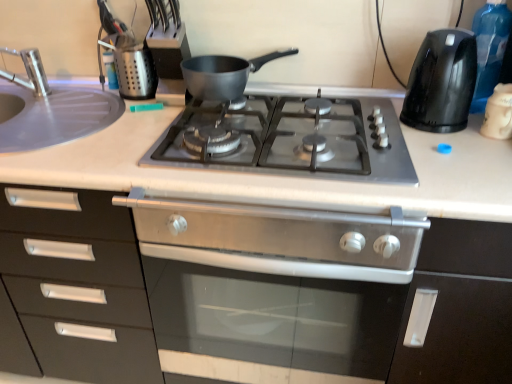
The height and width of the screenshot is (384, 512). Find the location of `transparent plastic bottle at right`. transparent plastic bottle at right is located at coordinates (489, 49).

Locate an element on the screen. The width and height of the screenshot is (512, 384). white glossy coffee cup at upper right, the third kitchen appliance viewed from the left is located at coordinates (498, 113).

What do you see at coordinates (498, 113) in the screenshot? I see `white glossy coffee cup at upper right, which is counted as the 1th kitchen appliance, starting from the right` at bounding box center [498, 113].

Describe the element at coordinates (132, 67) in the screenshot. I see `metallic silver utensil holder at upper left` at that location.

Locate an element on the screen. Image resolution: width=512 pixels, height=384 pixels. silver metallic faucet at left is located at coordinates (29, 71).

Locate an element on the screen. transparent plastic bottle at right is located at coordinates (489, 49).

In terms of size, does transparent plastic bottle at right appear bigger or smaller than silver metallic faucet at left?

transparent plastic bottle at right is bigger than silver metallic faucet at left.

Which object is positioned more to the right, transparent plastic bottle at right or silver metallic faucet at left?

Positioned to the right is transparent plastic bottle at right.

Would you say silver metallic faucet at left is part of transparent plastic bottle at right's contents?

No, silver metallic faucet at left is not a part of transparent plastic bottle at right.

In the scene shown: Is transparent plastic bottle at right positioned with its back to silver metallic faucet at left?

That's not correct — transparent plastic bottle at right is not looking away from silver metallic faucet at left.

Which of these two, metallic silver utensil holder at upper left or matte black pot at center, the 3th kitchen appliance viewed from the right, is wider?

With larger width is matte black pot at center, the 3th kitchen appliance viewed from the right.

Looking at this image, which object is closer to the camera, metallic silver utensil holder at upper left or matte black pot at center, acting as the 1th kitchen appliance starting from the left?

matte black pot at center, acting as the 1th kitchen appliance starting from the left, is in front.

Where is `the 1st kitchen appliance below when counting from the metallic silver utensil holder at upper left (from the image's perspective)`? the 1st kitchen appliance below when counting from the metallic silver utensil holder at upper left (from the image's perspective) is located at coordinates (223, 74).

Which object is positioned more to the right, metallic silver utensil holder at upper left or matte black pot at center, the 3th kitchen appliance viewed from the right?

matte black pot at center, the 3th kitchen appliance viewed from the right, is more to the right.

Considering the positions of objects white glossy coffee cup at upper right, which is counted as the 1th kitchen appliance, starting from the right, and stainless steel gas stove at center in the image provided, who is in front, white glossy coffee cup at upper right, which is counted as the 1th kitchen appliance, starting from the right, or stainless steel gas stove at center?

stainless steel gas stove at center is more forward.

Between white glossy coffee cup at upper right, which is counted as the 1th kitchen appliance, starting from the right, and stainless steel gas stove at center, which one appears on the left side from the viewer's perspective?

stainless steel gas stove at center.

Can you tell me how much white glossy coffee cup at upper right, the third kitchen appliance viewed from the left, and stainless steel gas stove at center differ in facing direction?

There is a 0.000242-degree angle between the facing directions of white glossy coffee cup at upper right, the third kitchen appliance viewed from the left, and stainless steel gas stove at center.

Between black plastic kettle at right, which ranks as the second kitchen appliance in left-to-right order, and stainless steel gas stove at center, which one appears on the left side from the viewer's perspective?

stainless steel gas stove at center is more to the left.

Looking at this image, is black plastic kettle at right, which ranks as the second kitchen appliance in left-to-right order, further to camera compared to stainless steel gas stove at center?

Yes.

Locate an element on the screen. kitchen appliance that is the 1st object located behind the stainless steel gas stove at center is located at coordinates (441, 82).

Is stainless steel gas stove at center located within black plastic kettle at right, the second kitchen appliance when ordered from right to left?

No.

Is matte black pot at center, the 3th kitchen appliance viewed from the right, in front of or behind white glossy coffee cup at upper right, which is counted as the 1th kitchen appliance, starting from the right, in the image?

Visually, matte black pot at center, the 3th kitchen appliance viewed from the right, is located behind white glossy coffee cup at upper right, which is counted as the 1th kitchen appliance, starting from the right.

Does point (249, 61) come closer to viewer compared to point (486, 133)?

That is False.

Would you consider matte black pot at center, acting as the 1th kitchen appliance starting from the left, to be distant from white glossy coffee cup at upper right, which is counted as the 1th kitchen appliance, starting from the right?

No, matte black pot at center, acting as the 1th kitchen appliance starting from the left, is not far away from white glossy coffee cup at upper right, which is counted as the 1th kitchen appliance, starting from the right.

Can you confirm if matte black pot at center, acting as the 1th kitchen appliance starting from the left, is shorter than white glossy coffee cup at upper right, the third kitchen appliance viewed from the left?

Correct, matte black pot at center, acting as the 1th kitchen appliance starting from the left, is not as tall as white glossy coffee cup at upper right, the third kitchen appliance viewed from the left.

How far apart are white glossy coffee cup at upper right, the third kitchen appliance viewed from the left, and black plastic kettle at right, which ranks as the second kitchen appliance in left-to-right order?

white glossy coffee cup at upper right, the third kitchen appliance viewed from the left, is 4.75 inches from black plastic kettle at right, which ranks as the second kitchen appliance in left-to-right order.

Is white glossy coffee cup at upper right, which is counted as the 1th kitchen appliance, starting from the right, looking in the opposite direction of black plastic kettle at right, which ranks as the second kitchen appliance in left-to-right order?

No, white glossy coffee cup at upper right, which is counted as the 1th kitchen appliance, starting from the right,'s orientation is not away from black plastic kettle at right, which ranks as the second kitchen appliance in left-to-right order.

Is white glossy coffee cup at upper right, the third kitchen appliance viewed from the left, thinner than black plastic kettle at right, which ranks as the second kitchen appliance in left-to-right order?

Indeed, white glossy coffee cup at upper right, the third kitchen appliance viewed from the left, has a lesser width compared to black plastic kettle at right, which ranks as the second kitchen appliance in left-to-right order.

Who is smaller, white glossy coffee cup at upper right, the third kitchen appliance viewed from the left, or black plastic kettle at right, the second kitchen appliance when ordered from right to left?

white glossy coffee cup at upper right, the third kitchen appliance viewed from the left.

Is metallic silver utensil holder at upper left far from white glossy coffee cup at upper right, the third kitchen appliance viewed from the left?

No, metallic silver utensil holder at upper left is not far away from white glossy coffee cup at upper right, the third kitchen appliance viewed from the left.

Is metallic silver utensil holder at upper left oriented away from white glossy coffee cup at upper right, which is counted as the 1th kitchen appliance, starting from the right?

That's not correct — metallic silver utensil holder at upper left is not looking away from white glossy coffee cup at upper right, which is counted as the 1th kitchen appliance, starting from the right.

From a real-world perspective, is metallic silver utensil holder at upper left positioned over white glossy coffee cup at upper right, which is counted as the 1th kitchen appliance, starting from the right, based on gravity?

Correct, in the physical world, metallic silver utensil holder at upper left is higher than white glossy coffee cup at upper right, which is counted as the 1th kitchen appliance, starting from the right.

Considering the positions of objects metallic silver utensil holder at upper left and white glossy coffee cup at upper right, the third kitchen appliance viewed from the left, in the image provided, who is in front, metallic silver utensil holder at upper left or white glossy coffee cup at upper right, the third kitchen appliance viewed from the left,?

white glossy coffee cup at upper right, the third kitchen appliance viewed from the left, is in front.

At what (x,y) coordinates should I click in order to perform the action: click on tap on the left of the transparent plastic bottle at right. Please return your answer as a coordinate pair (x, y). Looking at the image, I should click on (x=29, y=71).

Where is `appliance above the matte black pot at center, acting as the 1th kitchen appliance starting from the left (from the image's perspective)`? The height and width of the screenshot is (384, 512). appliance above the matte black pot at center, acting as the 1th kitchen appliance starting from the left (from the image's perspective) is located at coordinates (132, 67).

Based on their spatial positions, is silver metallic faucet at left or stainless steel gas stove at center closer to satin steel sink at left?

silver metallic faucet at left is positioned closer to the anchor satin steel sink at left.

Based on their spatial positions, is matte black pot at center, acting as the 1th kitchen appliance starting from the left, or black plastic kettle at right, which ranks as the second kitchen appliance in left-to-right order, further from metallic silver utensil holder at upper left?

Based on the image, black plastic kettle at right, which ranks as the second kitchen appliance in left-to-right order, appears to be further to metallic silver utensil holder at upper left.

Considering their positions, is satin black oven at center positioned closer to transparent plastic bottle at right than metallic silver utensil holder at upper left?

Among the two, satin black oven at center is located nearer to transparent plastic bottle at right.

Estimate the real-world distances between objects in this image. Which object is closer to matte black pot at center, acting as the 1th kitchen appliance starting from the left, satin steel sink at left or metallic silver utensil holder at upper left?

metallic silver utensil holder at upper left is closer to matte black pot at center, acting as the 1th kitchen appliance starting from the left.

Considering their positions, is white glossy coffee cup at upper right, which is counted as the 1th kitchen appliance, starting from the right, positioned further to silver metallic faucet at left than stainless steel gas stove at center?

The object further to silver metallic faucet at left is white glossy coffee cup at upper right, which is counted as the 1th kitchen appliance, starting from the right.

Which object lies nearer to the anchor point metallic silver utensil holder at upper left, silver metallic faucet at left or black plastic kettle at right, the second kitchen appliance when ordered from right to left?

silver metallic faucet at left is closer to metallic silver utensil holder at upper left.

Based on their spatial positions, is metallic silver utensil holder at upper left or white glossy coffee cup at upper right, which is counted as the 1th kitchen appliance, starting from the right, further from matte black pot at center, the 3th kitchen appliance viewed from the right?

white glossy coffee cup at upper right, which is counted as the 1th kitchen appliance, starting from the right, is positioned further to the anchor matte black pot at center, the 3th kitchen appliance viewed from the right.

When comparing their distances from transparent plastic bottle at right, does silver metallic faucet at left or satin steel sink at left seem closer?

satin steel sink at left lies closer to transparent plastic bottle at right than the other object.

Find the location of a particular element. The height and width of the screenshot is (384, 512). appliance between satin steel sink at left and matte black pot at center, the 3th kitchen appliance viewed from the right, in the horizontal direction is located at coordinates (132, 67).

Image resolution: width=512 pixels, height=384 pixels. In order to click on cabinetry located between silver metallic faucet at left and stainless steel gas stove at center in the left-right direction in this screenshot , I will do `click(239, 305)`.

At what (x,y) coordinates should I click in order to perform the action: click on kitchen appliance situated between stainless steel gas stove at center and white glossy coffee cup at upper right, the third kitchen appliance viewed from the left, from left to right. Please return your answer as a coordinate pair (x, y). Looking at the image, I should click on (441, 82).

Find the location of a particular element. This screenshot has width=512, height=384. kitchen appliance located between satin steel sink at left and stainless steel gas stove at center in the left-right direction is located at coordinates (223, 74).